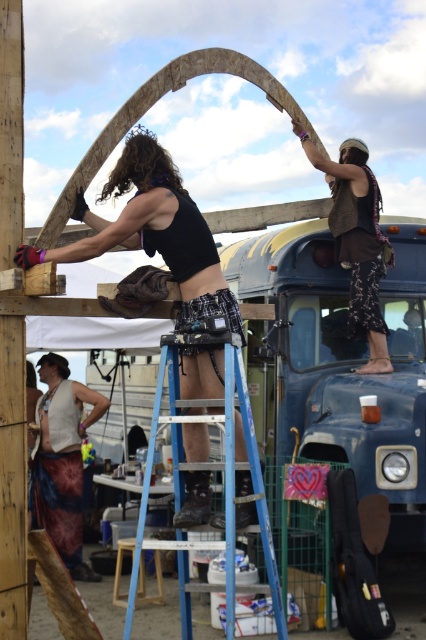
Is matte black tank top at center to the right of tie-dye fabric skirt at lower left from the viewer's perspective?

Correct, you'll find matte black tank top at center to the right of tie-dye fabric skirt at lower left.

Is point (199, 257) behind point (42, 497)?

No.

The width and height of the screenshot is (426, 640). I want to click on matte black tank top at center, so click(x=154, y=230).

This screenshot has width=426, height=640. I want to click on matte black tank top at center, so click(x=154, y=230).

Between matte black tank top at center and blue metallic ladder at center, which one is positioned higher?

Positioned higher is matte black tank top at center.

Can you confirm if matte black tank top at center is shorter than blue metallic ladder at center?

Yes.

Is point (140, 193) closer to viewer compared to point (175, 540)?

Yes, it is.

The width and height of the screenshot is (426, 640). In order to click on matte black tank top at center in this screenshot , I will do `click(154, 230)`.

Does matte black tank top at center appear under brown leather vest at upper center?

Yes, matte black tank top at center is below brown leather vest at upper center.

Image resolution: width=426 pixels, height=640 pixels. Find the location of `matte black tank top at center`. matte black tank top at center is located at coordinates (154, 230).

Where is `matte black tank top at center`? matte black tank top at center is located at coordinates (154, 230).